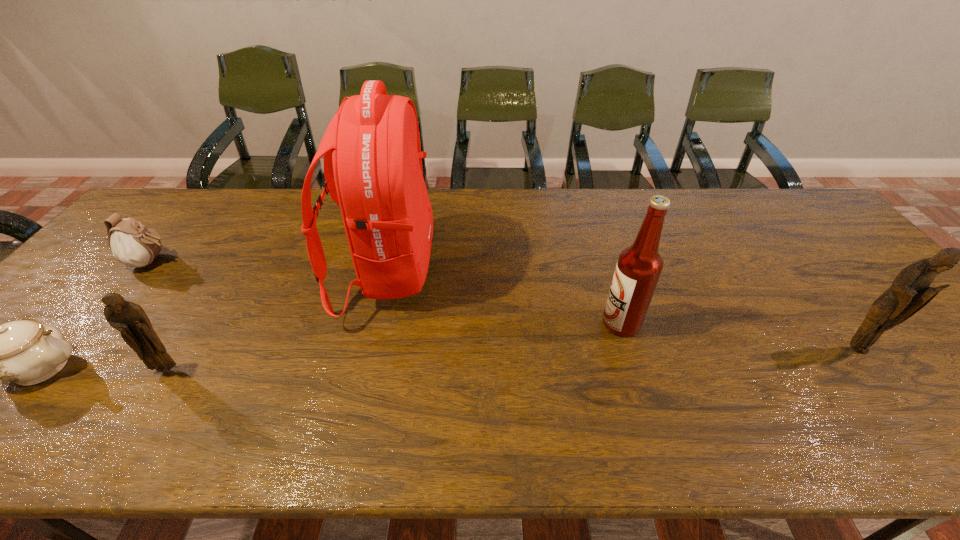
Locate an element on the screen. Image resolution: width=960 pixels, height=540 pixels. the third shortest object is located at coordinates (130, 319).

Identify the location of the fourth object from right to left. The image size is (960, 540). (130, 319).

Find the location of a particular element. the taller figurine is located at coordinates (910, 292).

Find the location of a particular element. the rightmost object is located at coordinates (910, 292).

The height and width of the screenshot is (540, 960). Find the location of `backpack`. backpack is located at coordinates (373, 171).

Locate an element on the screen. This screenshot has width=960, height=540. the third object from right to left is located at coordinates (373, 171).

You are a GUI agent. You are given a task and a screenshot of the screen. Output one action in this format:
    pyautogui.click(x=<x>, y=<y>)
    Task: Click on the pouch
    Image resolution: width=960 pixels, height=540 pixels.
    Given the screenshot: What is the action you would take?
    pyautogui.click(x=133, y=244)

Find the location of `the second object from right to left`. the second object from right to left is located at coordinates (639, 266).

You are a GUI agent. You are given a task and a screenshot of the screen. Output one action in this format:
    pyautogui.click(x=<x>, y=<y>)
    Task: Click on the vacant position located 0.050m on the front-facing side of the nearer figurine
    
    Given the screenshot: What is the action you would take?
    point(151,396)

I want to click on free region located on the front-facing side of the farther figurine, so click(896, 398).